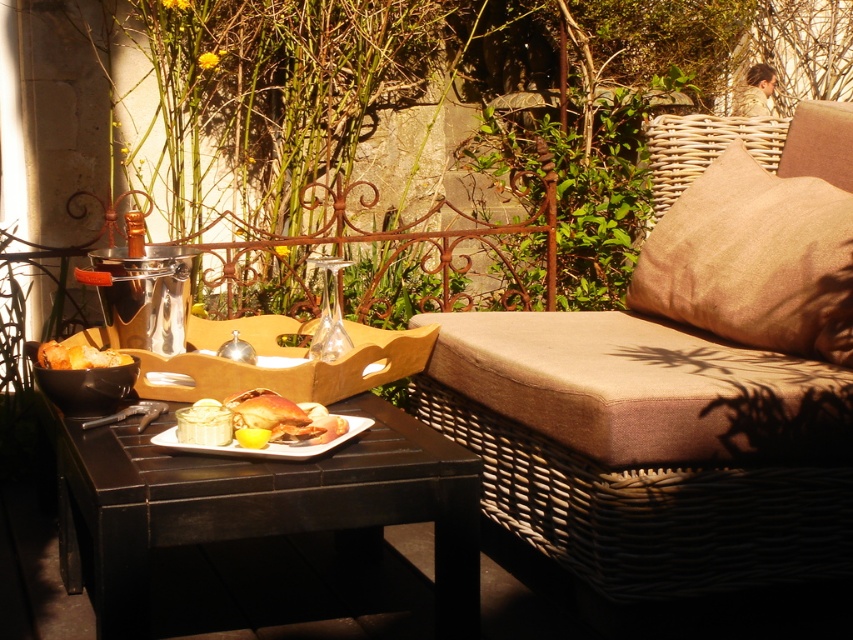
Question: Which object is closer to the camera taking this photo?

Choices:
 (A) shiny silver crab at center
 (B) golden crispy chicken at center
 (C) burlap cushion at right
 (D) black matte table at lower left

Answer: (D)

Question: Is black matte table at lower left above white glossy platter at center?

Choices:
 (A) no
 (B) yes

Answer: (A)

Question: Estimate the real-world distances between objects in this image. Which object is farther from the beige woven cushion at right?

Choices:
 (A) black matte table at lower left
 (B) white glossy platter at center

Answer: (B)

Question: Where is burlap cushion at right located in relation to white glossy platter at center in the image?

Choices:
 (A) left
 (B) right

Answer: (B)

Question: Considering the relative positions of black matte table at lower left and white glossy platter at center in the image provided, where is black matte table at lower left located with respect to white glossy platter at center?

Choices:
 (A) above
 (B) below

Answer: (B)

Question: Which object is closer to the camera taking this photo?

Choices:
 (A) white glossy platter at center
 (B) golden crispy chicken at center
 (C) beige woven cushion at right

Answer: (A)